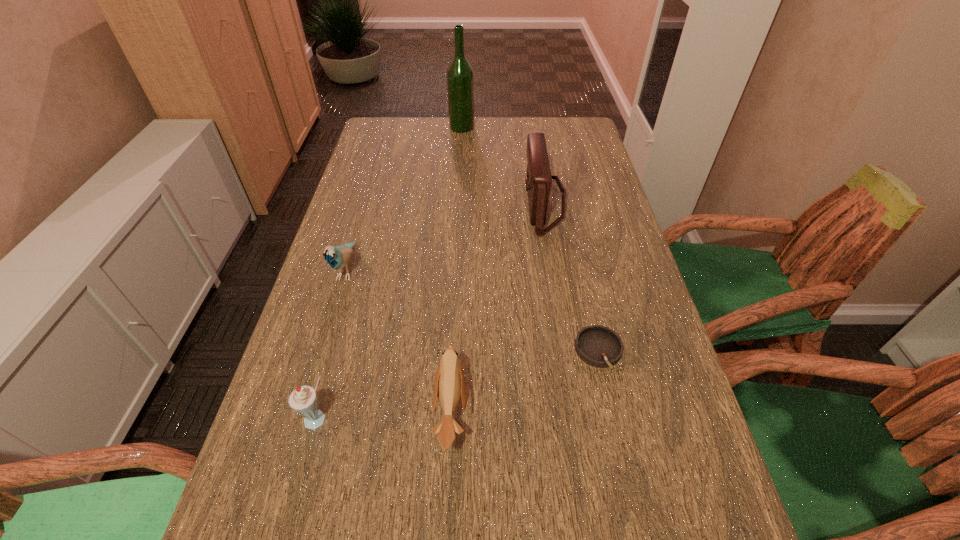
The image size is (960, 540). I want to click on milkshake that is at the left edge, so click(303, 400).

The height and width of the screenshot is (540, 960). I want to click on shoulder bag located at the right edge, so click(538, 180).

The width and height of the screenshot is (960, 540). In order to click on ashtray that is at the right edge in this screenshot , I will do [x=599, y=346].

The image size is (960, 540). Find the location of `vacant space at the far edge`. vacant space at the far edge is located at coordinates (479, 149).

You are a GUI agent. You are given a task and a screenshot of the screen. Output one action in this format:
    pyautogui.click(x=<x>, y=<y>)
    Task: Click on the vacant space at the left edge of the desktop
    Image resolution: width=960 pixels, height=540 pixels.
    Given the screenshot: What is the action you would take?
    pyautogui.click(x=392, y=183)

Find the location of `free space at the right edge of the desktop`. free space at the right edge of the desktop is located at coordinates (633, 259).

In the image, there is a desktop. Identify the location of free space at the far left corner. (391, 134).

This screenshot has width=960, height=540. Find the location of `vacant area that lies between the milkshake and the nearer bird`. vacant area that lies between the milkshake and the nearer bird is located at coordinates (385, 416).

Locate an element on the screen. vacant point located between the second farthest object and the fifth tallest object is located at coordinates (497, 307).

You are a GUI agent. You are given a task and a screenshot of the screen. Output one action in this format:
    pyautogui.click(x=<x>, y=<y>)
    Task: Click on the vacant area between the milkshake and the second tallest object
    This screenshot has width=960, height=540.
    Given the screenshot: What is the action you would take?
    pyautogui.click(x=431, y=311)